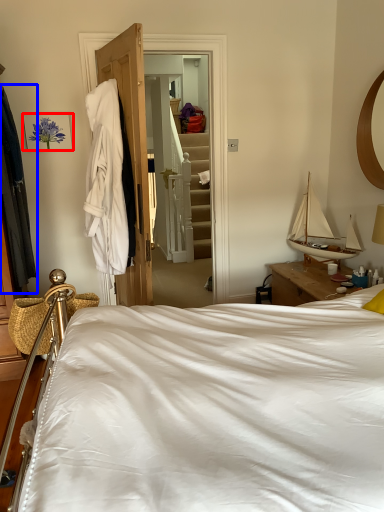
Question: Which object is closer to the camera taking this photo, picture frame (highlighted by a red box) or clothing (highlighted by a blue box)?

Choices:
 (A) picture frame
 (B) clothing

Answer: (B)